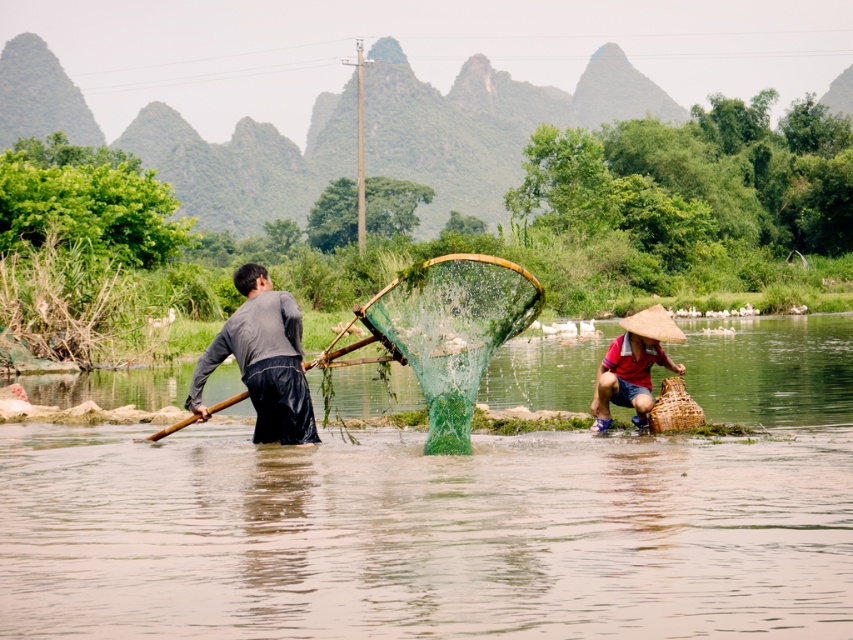
Question: Among these points, which one is nearest to the camera?

Choices:
 (A) (769, 524)
 (B) (465, 280)

Answer: (A)

Question: Does green mesh net at center lie in front of dark gray fabric shirt at center?

Choices:
 (A) no
 (B) yes

Answer: (B)

Question: Where is matte brown straw hat at lower right located in relation to wooden paddle at left in the image?

Choices:
 (A) right
 (B) left

Answer: (A)

Question: Where is dark gray fabric shirt at center located in relation to wooden paddle at left in the image?

Choices:
 (A) right
 (B) left

Answer: (B)

Question: Which object is positioned farthest from the wooden paddle at left?

Choices:
 (A) green mesh fishing net at center
 (B) dark gray fabric shirt at center
 (C) green mesh net at center
 (D) matte brown straw hat at lower right

Answer: (C)

Question: Based on their relative distances, which object is farther from the green mesh fishing net at center?

Choices:
 (A) dark gray fabric shirt at center
 (B) wooden paddle at left
 (C) green mesh net at center
 (D) matte brown straw hat at lower right

Answer: (C)